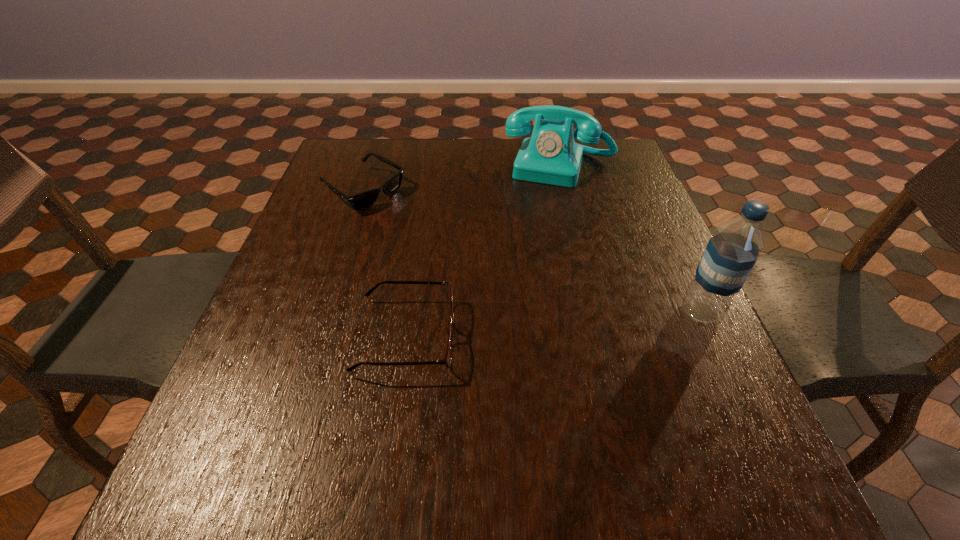
This screenshot has width=960, height=540. I want to click on empty space between the spectacles and the rightmost object, so click(553, 324).

Identify the location of free area in between the spectacles and the sunglasses. (385, 264).

I want to click on vacant space that is in between the third object from left to right and the tallest object, so click(630, 240).

Image resolution: width=960 pixels, height=540 pixels. I want to click on vacant point located between the second object from right to left and the sunglasses, so click(462, 179).

Identify the location of empty space between the third object from left to right and the sunglasses. Image resolution: width=960 pixels, height=540 pixels. (462, 179).

The image size is (960, 540). I want to click on vacant space that's between the spectacles and the telephone, so click(x=483, y=252).

Find the location of `empty space between the sunglasses and the water bottle`. empty space between the sunglasses and the water bottle is located at coordinates (532, 252).

This screenshot has width=960, height=540. I want to click on vacant area that lies between the sunglasses and the tallest object, so click(x=532, y=252).

The width and height of the screenshot is (960, 540). I want to click on free space between the spectacles and the second tallest object, so click(x=483, y=252).

What are the coordinates of `object that is the closest to the sunglasses` in the screenshot? It's located at (550, 156).